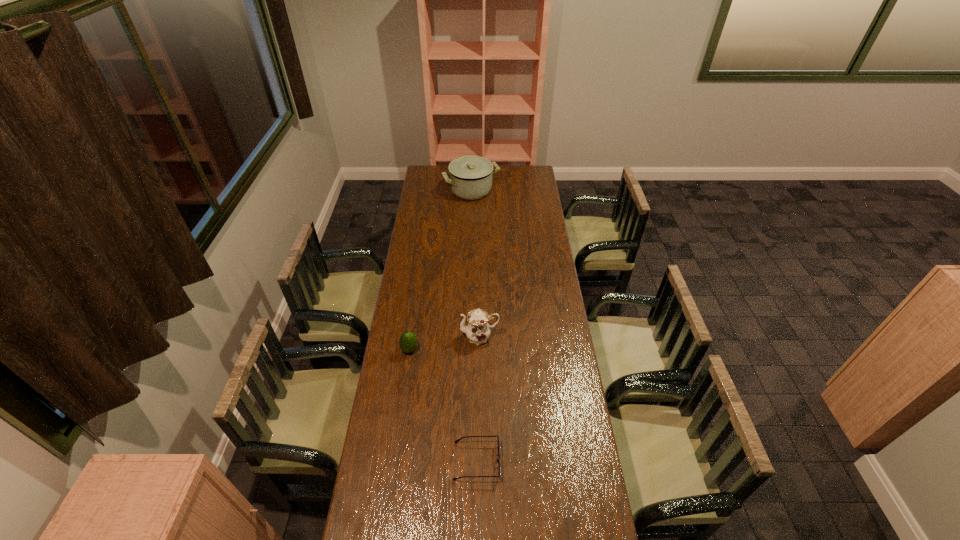
The width and height of the screenshot is (960, 540). I want to click on the farthest object, so click(470, 177).

In order to click on chinaware in this screenshot , I will do tap(477, 330).

I want to click on avocado, so click(408, 342).

The width and height of the screenshot is (960, 540). Identify the location of the third tallest object. (408, 342).

Where is `the nearest object`? The image size is (960, 540). the nearest object is located at coordinates (458, 440).

Identify the location of spectacles. Image resolution: width=960 pixels, height=540 pixels. (458, 440).

Where is `free space located on the left of the saucepan`? This screenshot has width=960, height=540. free space located on the left of the saucepan is located at coordinates [x=430, y=191].

You are a GUI agent. You are given a task and a screenshot of the screen. Output one action in this format:
    pyautogui.click(x=<x>, y=<y>)
    Task: Click on the blank area located 0.280m on the back of the chinaware
    The height and width of the screenshot is (540, 960).
    Given the screenshot: What is the action you would take?
    pyautogui.click(x=480, y=281)

You are a GUI agent. You are given a task and a screenshot of the screen. Output one action in this format:
    pyautogui.click(x=<x>, y=<y>)
    Task: Click on the vacant space located on the back of the avocado
    The height and width of the screenshot is (540, 960).
    Given the screenshot: What is the action you would take?
    pyautogui.click(x=420, y=279)

Locate an element on the screen. The width and height of the screenshot is (960, 540). free location located 0.200m on the front-facing side of the nearest object is located at coordinates 559,461.